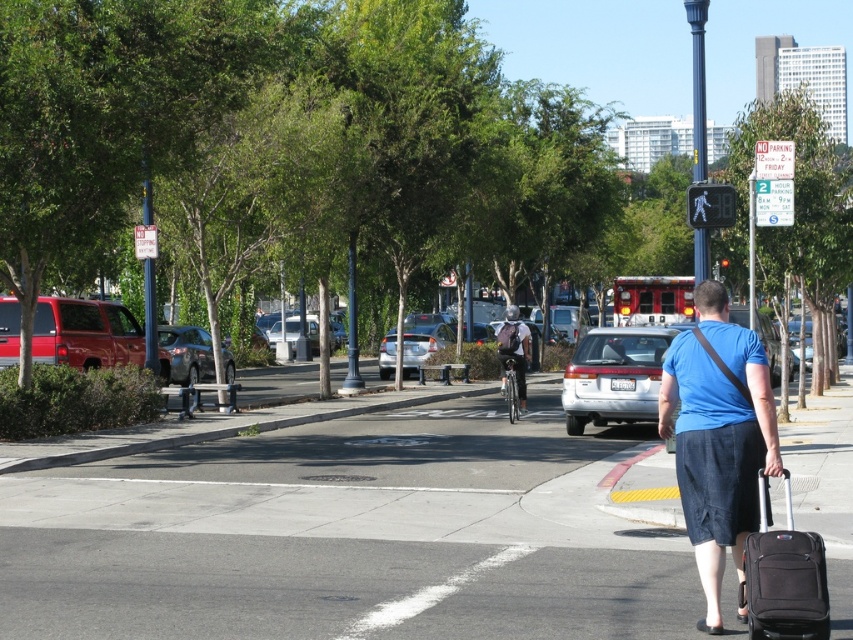
Between gray asphalt at center and matte red suv at left, which one has less height?

gray asphalt at center

Which is in front, point (627, 484) or point (3, 349)?

Positioned in front is point (627, 484).

Find the location of `gray asphalt at center`. gray asphalt at center is located at coordinates point(357,534).

Which is more to the left, blue denim shorts at lower right or black fabric suitcase at lower right?

From the viewer's perspective, blue denim shorts at lower right appears more on the left side.

In the scene shown: Can you confirm if blue denim shorts at lower right is shorter than black fabric suitcase at lower right?

No, blue denim shorts at lower right is not shorter than black fabric suitcase at lower right.

What are the coordinates of `blue denim shorts at lower right` in the screenshot? It's located at (718, 438).

Find the location of `blue denim shorts at lower right`. blue denim shorts at lower right is located at coordinates (718, 438).

Who is positioned more to the left, metallic gray sedan at left or satin silver sedan at center?

Positioned to the left is metallic gray sedan at left.

Does metallic gray sedan at left appear over satin silver sedan at center?

Yes, metallic gray sedan at left is above satin silver sedan at center.

Find the location of a particular element. metallic gray sedan at left is located at coordinates (187, 353).